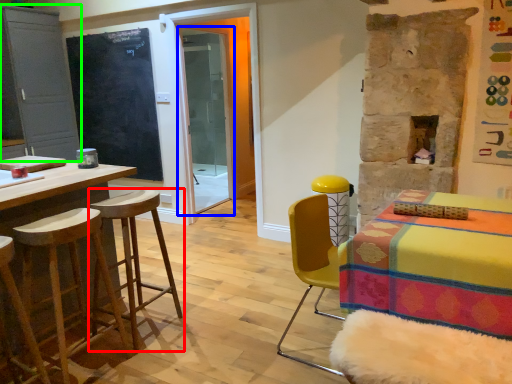
Question: Which object is the closest to the stool (highlighted by a red box)? Choose among these: screen door (highlighted by a blue box) or cabinetry (highlighted by a green box).

Choices:
 (A) screen door
 (B) cabinetry

Answer: (B)